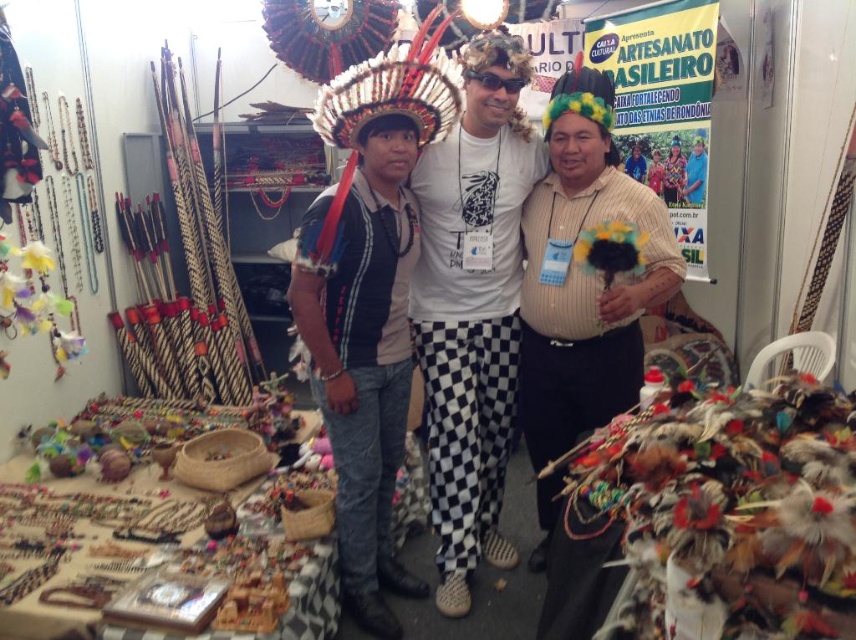
Does shiny metallic headdress at center have a greater width compared to matte black headdress at center?

Yes, shiny metallic headdress at center is wider than matte black headdress at center.

Which is in front, point (325, 84) or point (697, 176)?

Point (325, 84) is in front.

Does point (447, 65) lie in front of point (694, 202)?

Yes, point (447, 65) is in front of point (694, 202).

Find the location of a particular element. shiny metallic headdress at center is located at coordinates (393, 90).

Who is more distant from viewer, (498,452) or (382,243)?

Positioned behind is point (498,452).

I want to click on matte black jacket at center, so click(x=473, y=307).

Which is below, white checkered pants at center or matte black shirt at center?

matte black shirt at center is below.

The height and width of the screenshot is (640, 856). Identify the location of white checkered pants at center. (473, 307).

Where is `white checkered pants at center`? white checkered pants at center is located at coordinates (473, 307).

Where is `white checkered pants at center`? white checkered pants at center is located at coordinates (473, 307).